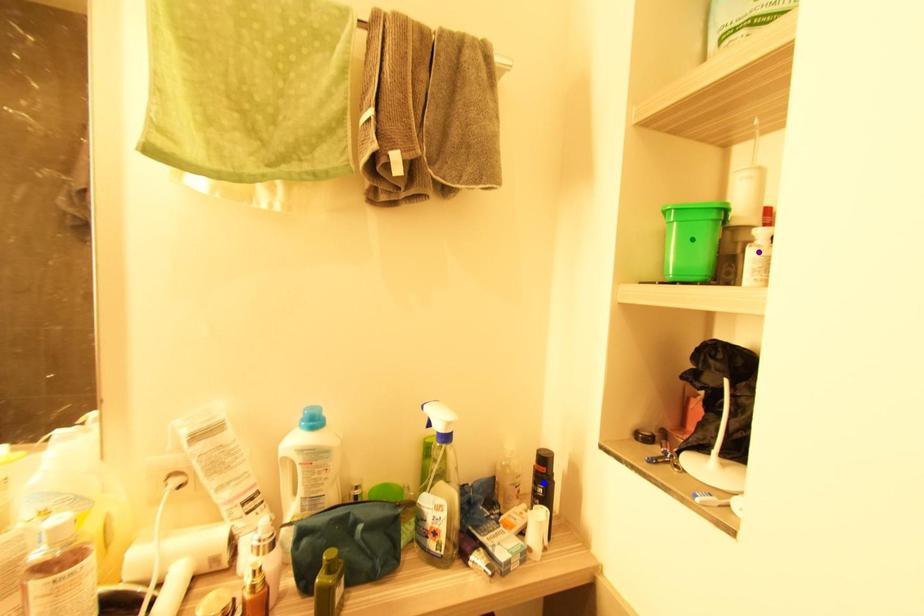
Order these from nearest to farthest:
A) green point
B) purple point
C) blue point

blue point
green point
purple point